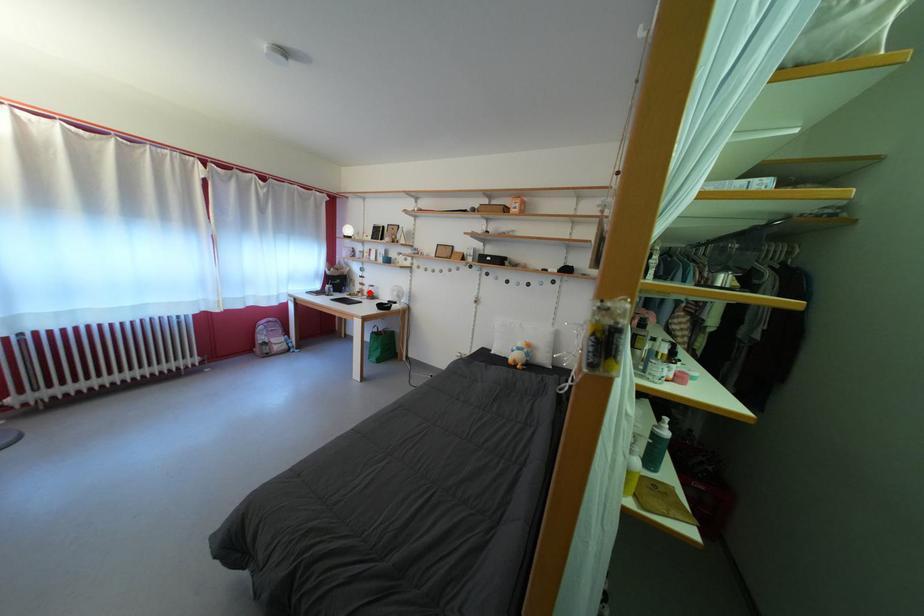
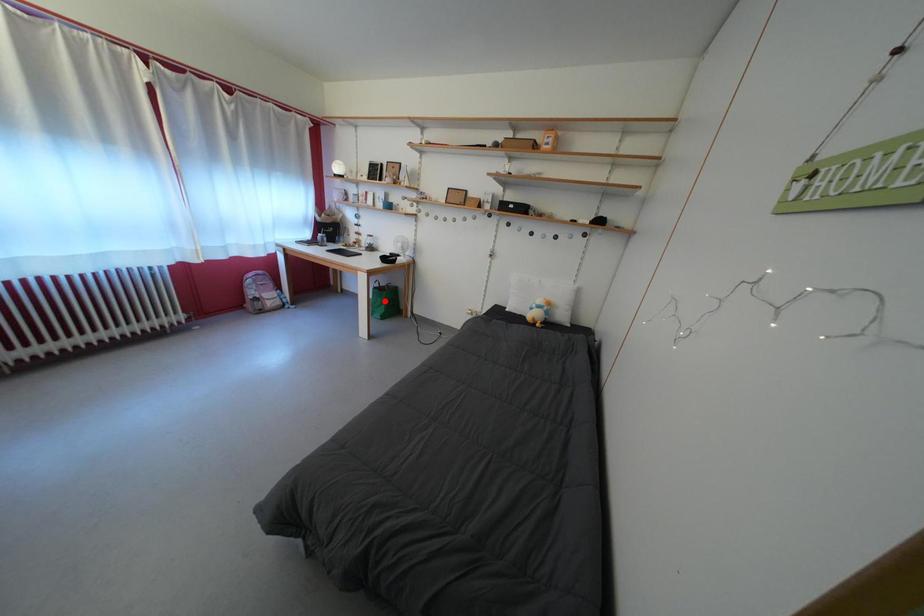
I am providing you with two images of the same scene from different viewpoints. A red point is marked on the first image and another point is marked on the second image. Do the highlighted points in image1 and image2 indicate the same real-world spot?

No